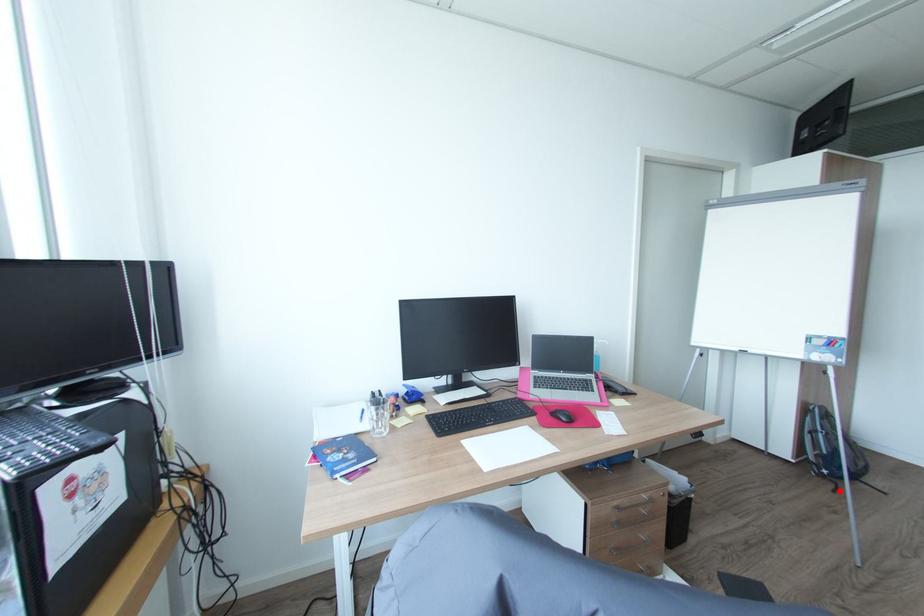
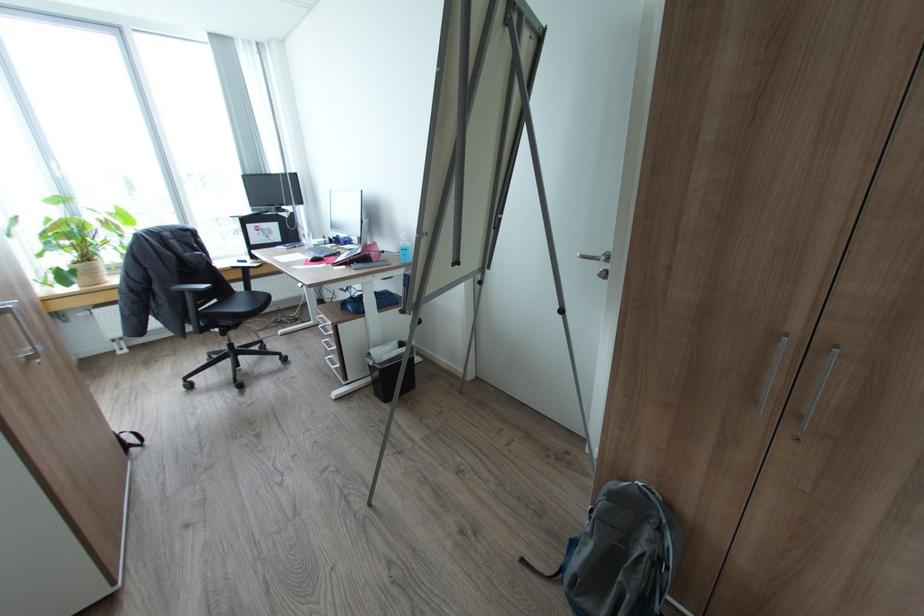
The point at the highlighted location is marked in the first image. Where is the corresponding point in the second image?

(527, 560)